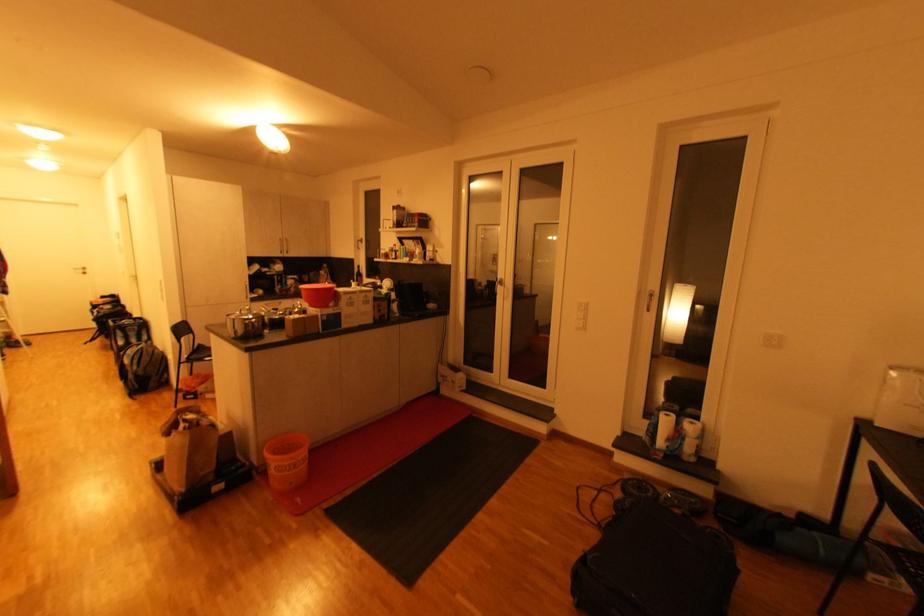
Where would you pull the silver cabinet handle? Please return your answer as a coordinate pair (x, y).

(285, 245)